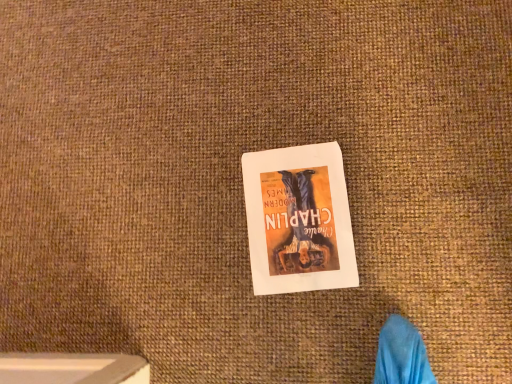
At what (x,y) coordinates should I click in order to perform the action: click on vacant area that is situated to the right of white paper at center. Please return your answer as a coordinate pair (x, y). Looking at the image, I should click on (392, 150).